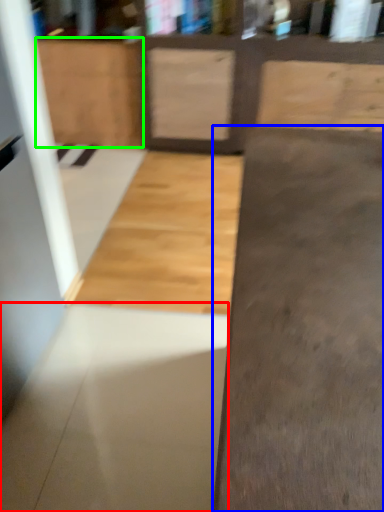
Question: Which object is the closest to the concrete (highlighted by a red box)? Choose among these: concrete (highlighted by a blue box) or cabinetry (highlighted by a green box).

Choices:
 (A) concrete
 (B) cabinetry

Answer: (A)